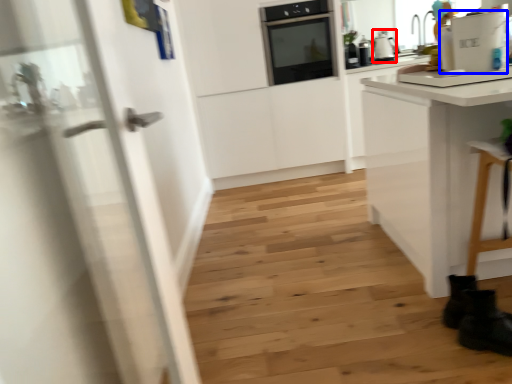
Question: Which of the following is the closest to the observer, kitchen appliance (highlighted by a red box) or appliance (highlighted by a blue box)?

Choices:
 (A) kitchen appliance
 (B) appliance

Answer: (B)